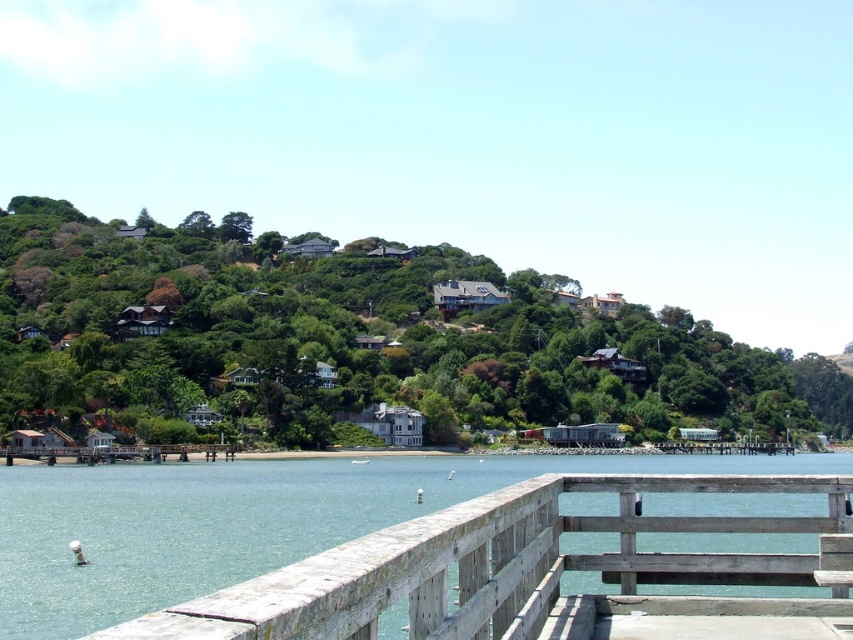
Is green leafy hillside at upper center closer to the viewer compared to weathered wood rail at lower center?

That is False.

Does green leafy hillside at upper center have a lesser height compared to weathered wood rail at lower center?

Result: Incorrect, green leafy hillside at upper center's height does not fall short of weathered wood rail at lower center's.

Describe the element at coordinates (358, 337) in the screenshot. I see `green leafy hillside at upper center` at that location.

Find the location of a particular element. This screenshot has width=853, height=640. green leafy hillside at upper center is located at coordinates (358, 337).